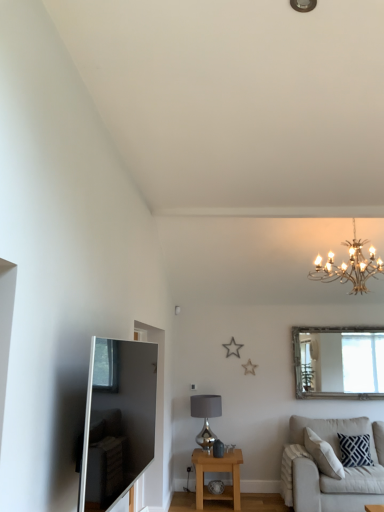
Question: Based on their sizes in the image, would you say light oak wooden side table at lower center is bigger or smaller than silver metallic lampshade at center?

Choices:
 (A) small
 (B) big

Answer: (B)

Question: In terms of height, does light oak wooden side table at lower center look taller or shorter compared to silver metallic lampshade at center?

Choices:
 (A) tall
 (B) short

Answer: (B)

Question: Which object is the closest to the gold metallic chandelier at upper right?

Choices:
 (A) light oak wooden side table at lower center
 (B) satin silver tv at left
 (C) silver metallic lampshade at center
 (D) navy blue textured pillow at lower right
 (E) light beige fabric couch at lower right

Answer: (C)

Question: Which is nearer to the silver metallic lampshade at center?

Choices:
 (A) gold metallic chandelier at upper right
 (B) satin silver tv at left
 (C) light beige fabric couch at lower right
 (D) navy blue textured pillow at lower right
 (E) silver-framed mirror at upper right

Answer: (C)